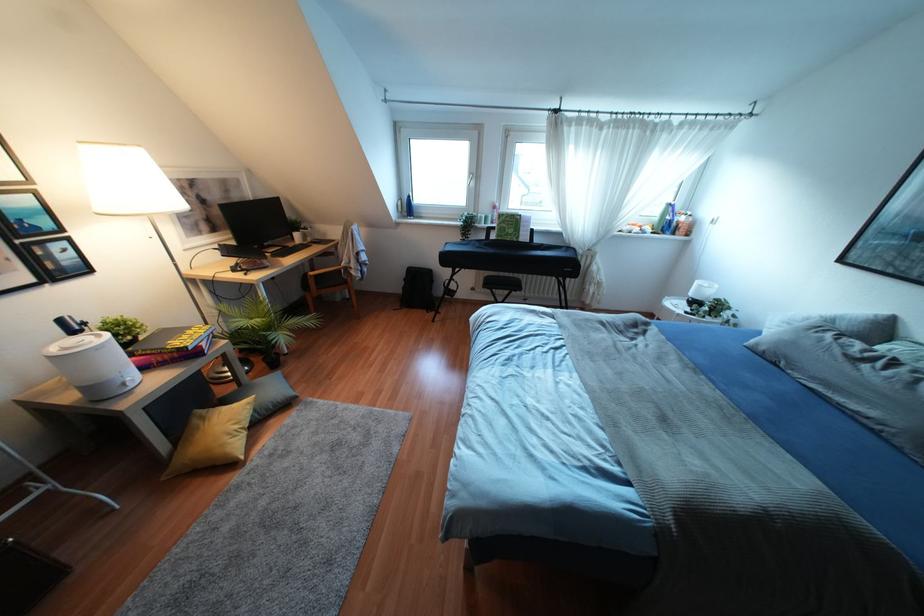
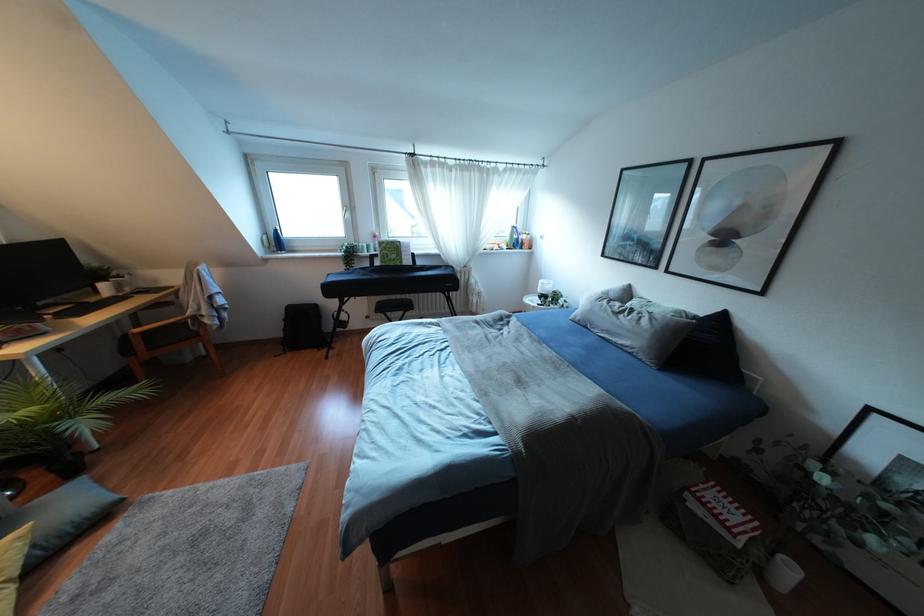
Where in the second image is the point corresponding to point 470,183 from the first image?

(346, 215)